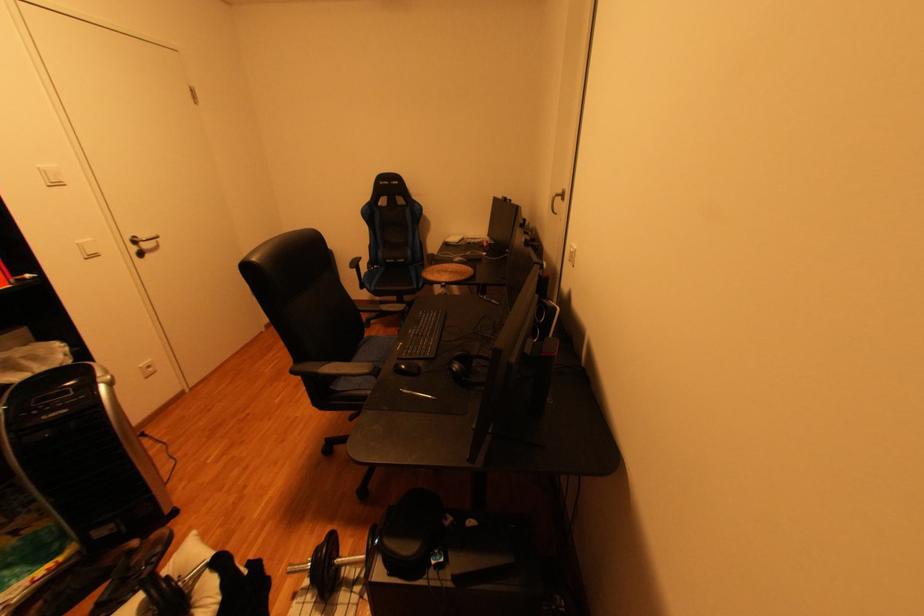
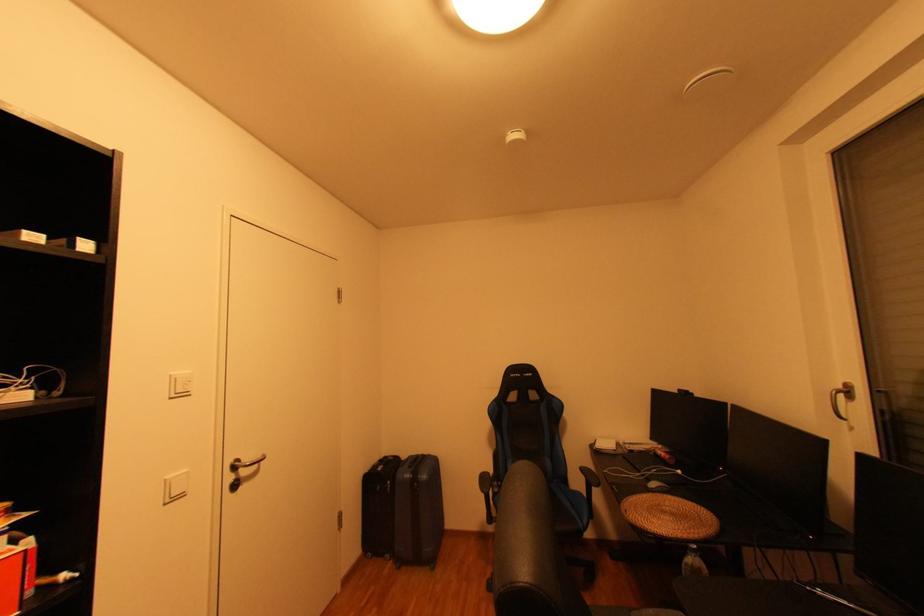
The point at (x=456, y=272) is marked in the first image. Where is the corresponding point in the second image?

(674, 513)